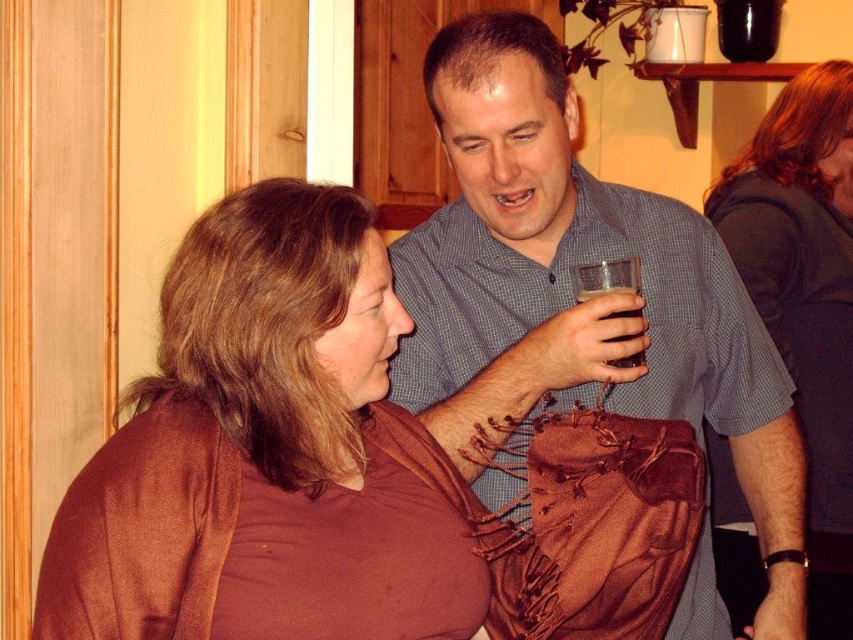
You are standing in the social setting shown in the image and want to move from the point at coordinates point (746, 253) to the point at coordinates point (614, 285). Which direction should you move to get closer to the second point?

To move from point (746, 253) to point (614, 285), you should move upwards and to the right since the second point is located above and to the right of the first point.

Consider the image. You are at a party and want to hand a drink to the person near the door frame. The clear glass at upper right and dark gray fabric at upper right are in your line of sight. Which object is closer to you?

The dark gray fabric at upper right is closer to you because the clear glass at upper right is behind it.

You are standing in the same room as the two people in the image. The brown fabric scarf at center is located at point [262,452]. If you want to hand the scarf to the person on the right, should you walk towards them or away from them?

The brown fabric scarf at center is located at point [262,452]. Since the person on the right is closer to the scarf than the person on the left, you should walk towards them to hand the scarf to the person on the right.